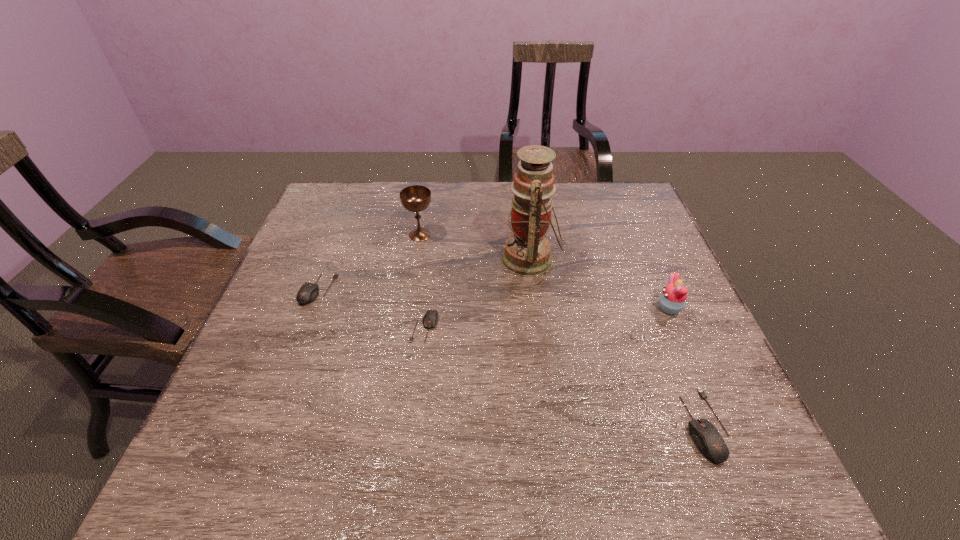
Image resolution: width=960 pixels, height=540 pixels. In order to click on the farthest mouse in this screenshot , I will do (308, 292).

Locate an element on the screen. the fifth tallest object is located at coordinates (308, 292).

Where is `the second mouse from left to right`? The image size is (960, 540). the second mouse from left to right is located at coordinates (430, 318).

Where is `the shortest object`? The width and height of the screenshot is (960, 540). the shortest object is located at coordinates (430, 318).

The height and width of the screenshot is (540, 960). In order to click on the tallest mouse in this screenshot , I will do `click(707, 438)`.

Image resolution: width=960 pixels, height=540 pixels. I want to click on the nearest mouse, so click(707, 438).

Find the location of `chalice`. chalice is located at coordinates tap(416, 198).

This screenshot has width=960, height=540. Identify the location of oil lamp. (527, 252).

Locate an element on the screen. the tallest object is located at coordinates (527, 252).

In order to click on cupcake in this screenshot , I will do tap(672, 300).